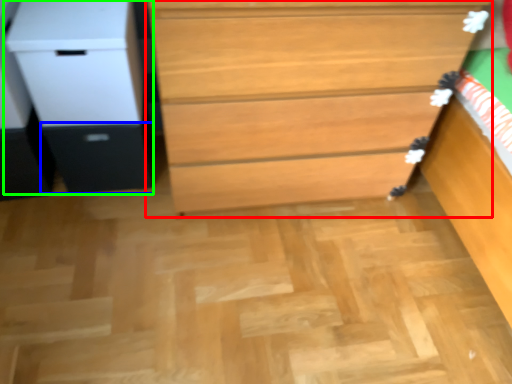
Question: Which object is positioned farthest from chest of drawers (highlighted by a red box)? Select from drawer (highlighted by a blue box) and file cabinet (highlighted by a green box).

Choices:
 (A) drawer
 (B) file cabinet

Answer: (A)